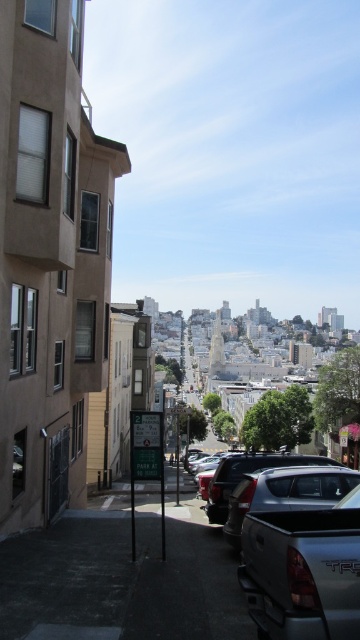
Question: Does silver metallic truck at lower right have a greater width compared to metallic silver parking sign at center?

Choices:
 (A) no
 (B) yes

Answer: (B)

Question: Does silver metallic truck at lower right appear over metallic silver parking sign at center?

Choices:
 (A) no
 (B) yes

Answer: (B)

Question: Can you confirm if silver metallic truck at lower right is thinner than metallic silver parking sign at center?

Choices:
 (A) yes
 (B) no

Answer: (B)

Question: Among these points, which one is farthest from the camera?

Choices:
 (A) (280, 470)
 (B) (144, 433)

Answer: (B)

Question: Which object is farther from the camera taking this photo?

Choices:
 (A) metallic silver parking sign at center
 (B) silver metallic truck at lower right

Answer: (A)